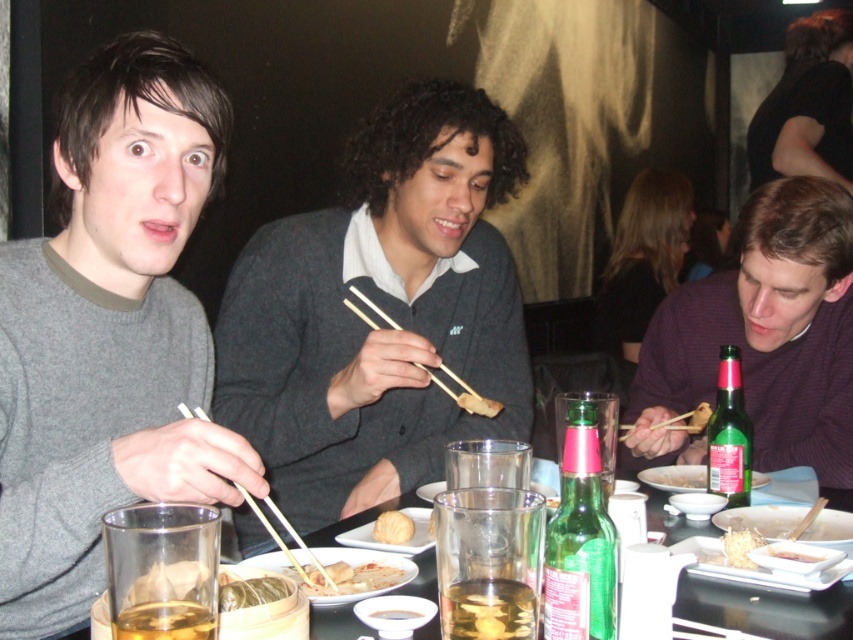
Is white crispy noodles at center bigger than brown matte chopsticks at center?

No, white crispy noodles at center is not bigger than brown matte chopsticks at center.

Can you confirm if white crispy noodles at center is smaller than brown matte chopsticks at center?

Correct, white crispy noodles at center occupies less space than brown matte chopsticks at center.

Which is in front, point (763, 541) or point (460, 394)?

Point (763, 541)

Find the location of a particular element. The width and height of the screenshot is (853, 640). white crispy noodles at center is located at coordinates (741, 547).

Between clear glass at center and brown matte chopsticks at center, which one has more height?

clear glass at center is taller.

Which is more to the right, clear glass at center or brown matte chopsticks at center?

Positioned to the right is clear glass at center.

Between point (712, 532) and point (474, 397), which one is positioned behind?

The point (474, 397) is behind.

This screenshot has width=853, height=640. I want to click on clear glass at center, so click(x=767, y=609).

Between green glass bottle at right and golden fried dumpling at center, which one has less height?

golden fried dumpling at center is shorter.

Is green glass bottle at right above golden fried dumpling at center?

Yes.

Is point (728, 484) closer to camera compared to point (386, 582)?

No, (728, 484) is further to viewer.

Find the location of `green glass bottle at right`. green glass bottle at right is located at coordinates (729, 433).